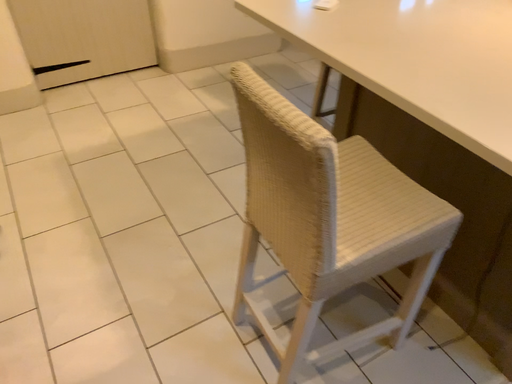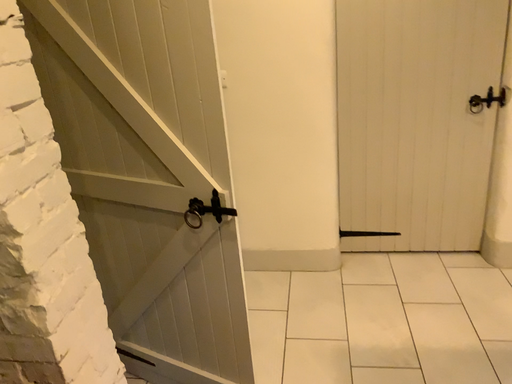
Question: How did the camera likely rotate when shooting the video?

Choices:
 (A) rotated upward
 (B) rotated downward

Answer: (A)